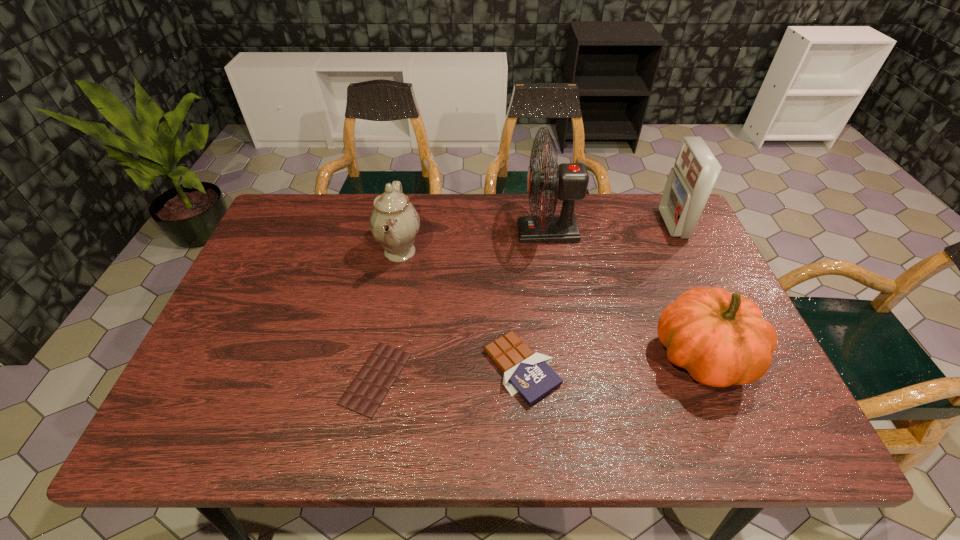
At what (x,y) coordinates should I click in order to perform the action: click on fan. Please return your answer as a coordinate pair (x, y). This screenshot has height=540, width=960. Looking at the image, I should click on (569, 182).

Where is `the first-aid kit`? The width and height of the screenshot is (960, 540). the first-aid kit is located at coordinates (690, 182).

The height and width of the screenshot is (540, 960). What are the coordinates of `chinaware` in the screenshot? It's located at (394, 222).

The height and width of the screenshot is (540, 960). Find the location of `pumpkin`. pumpkin is located at coordinates (720, 338).

Find the location of `the taller chocolate bar`. the taller chocolate bar is located at coordinates (529, 374).

At what (x,y) coordinates should I click in order to perform the action: click on the second shortest object. Please return your answer as a coordinate pair (x, y). This screenshot has height=540, width=960. Looking at the image, I should click on (529, 374).

Where is `the shorter chocolate bar`? the shorter chocolate bar is located at coordinates (367, 391).

Identify the location of the left chocolate bar. This screenshot has width=960, height=540. (367, 391).

Find the location of a particular element. This screenshot has height=540, width=960. vacant area located on the front-facing side of the fan is located at coordinates (387, 232).

At what (x,y) coordinates should I click in order to perform the action: click on blank area located on the front-facing side of the fan. Please return your answer as a coordinate pair (x, y). Looking at the image, I should click on (391, 232).